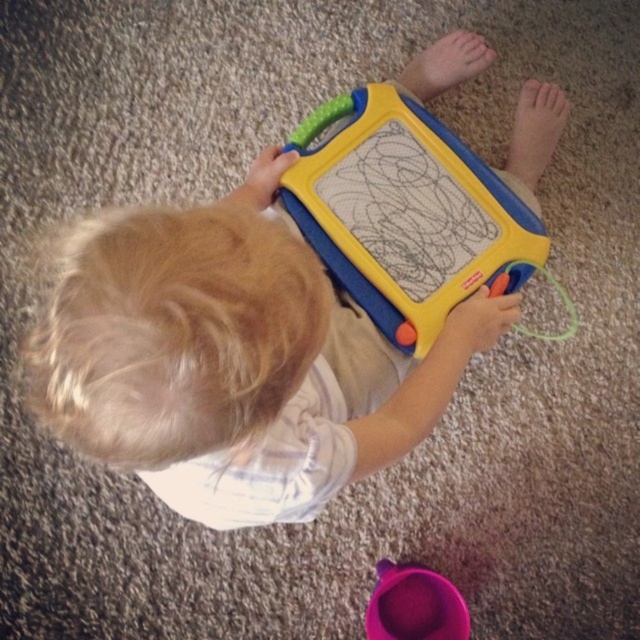
Describe the element at coordinates (406, 212) in the screenshot. I see `yellow plastic drawing board at center` at that location.

Is point (445, 268) positioned before point (442, 621)?

Yes, it is.

At what (x,y) coordinates should I click in order to perform the action: click on yellow plastic drawing board at center. Please return your answer as a coordinate pair (x, y). The width and height of the screenshot is (640, 640). Looking at the image, I should click on (406, 212).

Which is above, yellow plastic toy at center or yellow plastic drawing board at center?

yellow plastic drawing board at center is higher up.

Who is taller, yellow plastic toy at center or yellow plastic drawing board at center?

yellow plastic toy at center

Where is `yellow plastic toy at center`? The image size is (640, 640). yellow plastic toy at center is located at coordinates (232, 358).

Which is more to the left, yellow plastic toy at center or purple plastic cup at lower center?

yellow plastic toy at center is more to the left.

Who is more distant from viewer, (269, 288) or (369, 628)?

The point (369, 628) is behind.

At what (x,y) coordinates should I click in order to perform the action: click on yellow plastic toy at center. Please return your answer as a coordinate pair (x, y). Looking at the image, I should click on (232, 358).